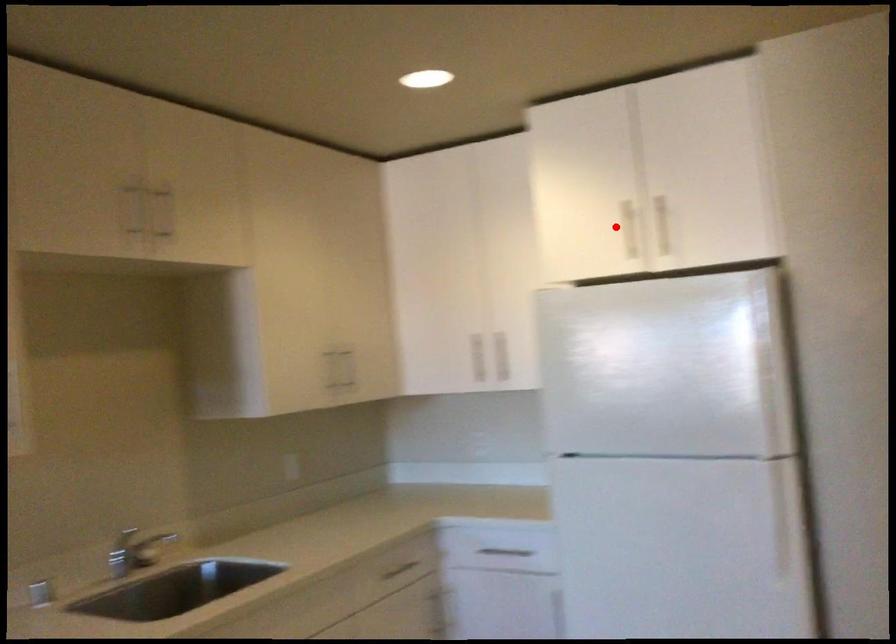
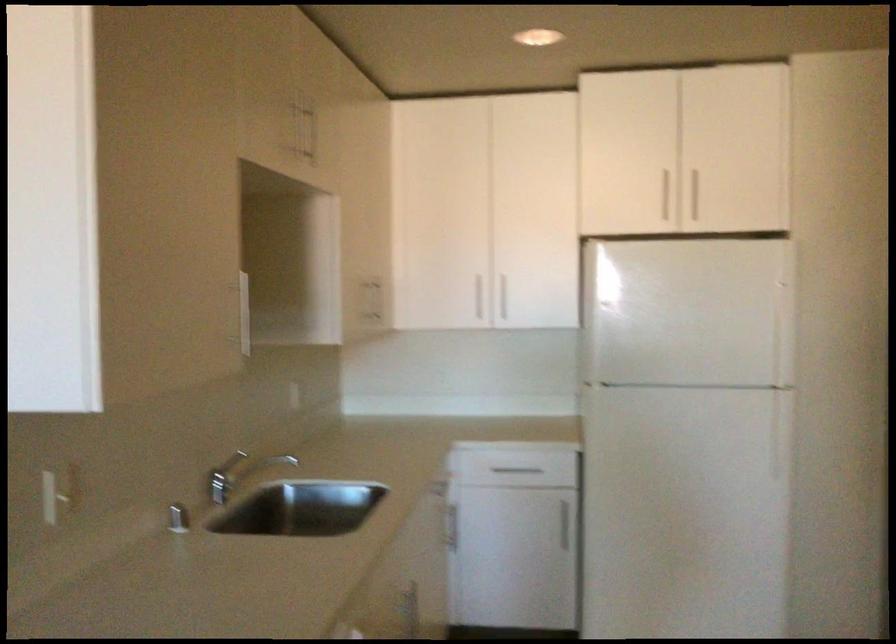
Question: I am providing you with two images of the same scene from different viewpoints. Given a red point in image1, look at the same physical point in image2. Is it:

Choices:
 (A) Closer to the viewpoint
 (B) Farther from the viewpoint

Answer: (B)